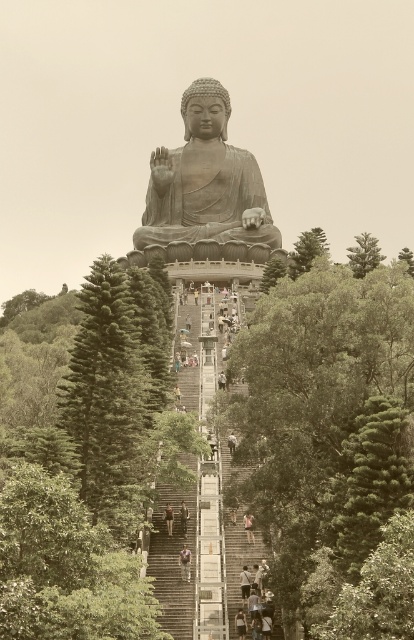
Question: Considering the relative positions of dark brown leather shoes at center and dark brown wooden stairs at center in the image provided, where is dark brown leather shoes at center located with respect to dark brown wooden stairs at center?

Choices:
 (A) below
 (B) above

Answer: (A)

Question: Considering the relative positions of camouflage pants at center and light brown wooden stairs at center in the image provided, where is camouflage pants at center located with respect to light brown wooden stairs at center?

Choices:
 (A) below
 (B) above

Answer: (B)

Question: Estimate the real-world distances between objects in this image. Which object is farther from the light brown wooden bench at center?

Choices:
 (A) dark brown wooden stairs at center
 (B) light brown wooden stairs at center

Answer: (B)

Question: In this image, where is green leafy tree at center located relative to dark brown leather shoes at center?

Choices:
 (A) above
 (B) below

Answer: (A)

Question: Which point is closer to the camera?

Choices:
 (A) green leafy tree at center
 (B) green textured tree at upper center

Answer: (A)

Question: Which of the following is the closest to the observer?

Choices:
 (A) (187, 552)
 (B) (243, 577)
 (C) (245, 180)

Answer: (B)